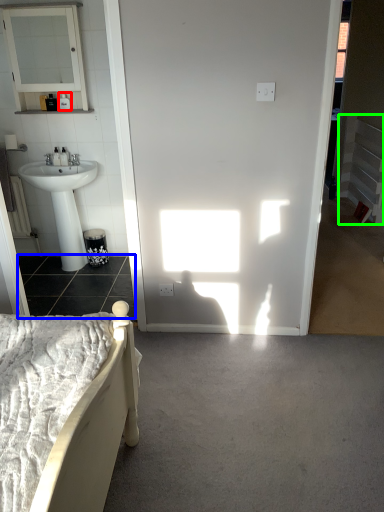
Question: Which object is positioned farthest from toiletry (highlighted by a red box)? Select from concrete (highlighted by a blue box) and balustrade (highlighted by a green box).

Choices:
 (A) concrete
 (B) balustrade

Answer: (B)